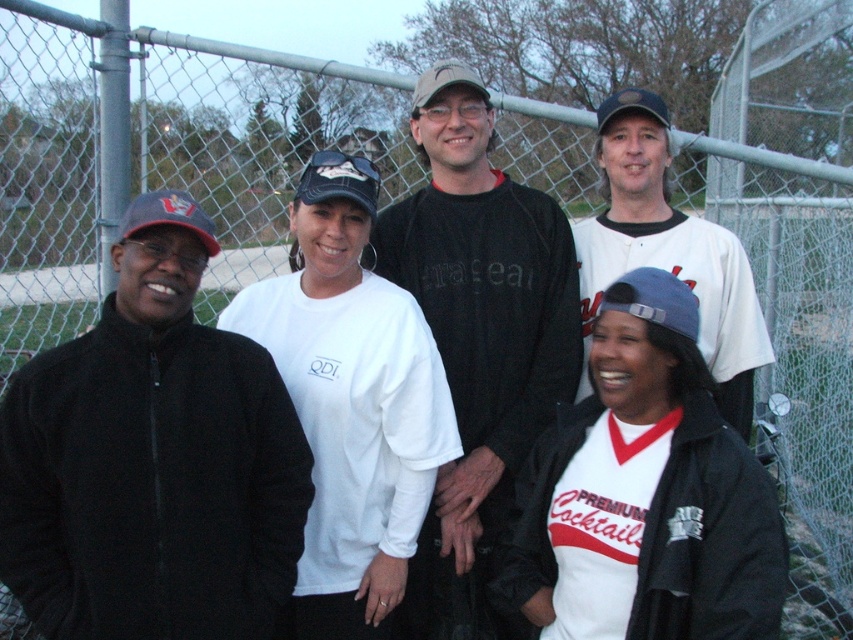
Who is positioned more to the left, white cotton t-shirt at center or blue fabric baseball cap at center?

white cotton t-shirt at center

Measure the distance between white cotton t-shirt at center and camera.

white cotton t-shirt at center is 2.46 meters from camera.

Where is `white cotton t-shirt at center`? white cotton t-shirt at center is located at coordinates tap(354, 428).

Is blue fabric baseball cap at center shorter than black fabric baseball cap at center?

Indeed, blue fabric baseball cap at center has a lesser height compared to black fabric baseball cap at center.

Can you confirm if blue fabric baseball cap at center is positioned above black fabric baseball cap at center?

Actually, blue fabric baseball cap at center is below black fabric baseball cap at center.

Which is behind, point (692, 323) or point (308, 172)?

Positioned behind is point (308, 172).

Where is `blue fabric baseball cap at center`? The width and height of the screenshot is (853, 640). blue fabric baseball cap at center is located at coordinates (657, 300).

Can you confirm if white jersey at lower center is smaller than camouflage fabric baseball cap at center?

Indeed, white jersey at lower center has a smaller size compared to camouflage fabric baseball cap at center.

Can you confirm if white jersey at lower center is positioned to the left of camouflage fabric baseball cap at center?

In fact, white jersey at lower center is to the right of camouflage fabric baseball cap at center.

What do you see at coordinates (711, 540) in the screenshot?
I see `white jersey at lower center` at bounding box center [711, 540].

Identify the location of white jersey at lower center. This screenshot has width=853, height=640. (711, 540).